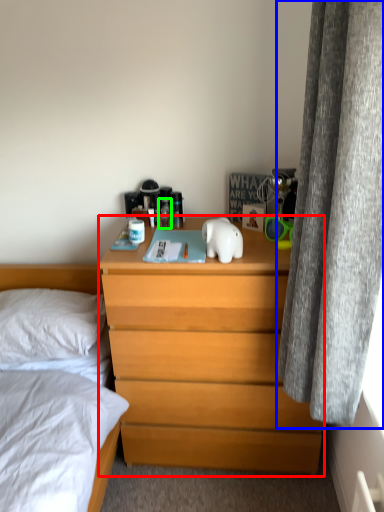
Question: Which object is positioned closest to chest of drawers (highlighted by a red box)? Select from curtain (highlighted by a blue box) and toiletry (highlighted by a green box).

Choices:
 (A) curtain
 (B) toiletry

Answer: (A)